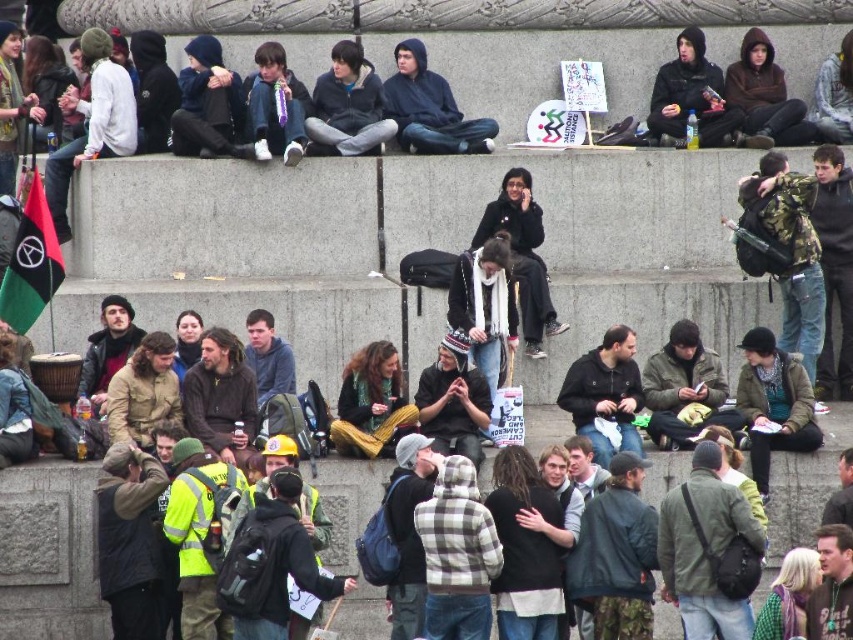
Find the location of a particular element. Image resolution: width=853 pixels, height=640 pixels. dark blue hoodie at center is located at coordinates (430, 108).

Is dark blue hoodie at center below dark gray hoodie at upper right?

Correct, dark blue hoodie at center is located below dark gray hoodie at upper right.

Identify the location of dark blue hoodie at center. (430, 108).